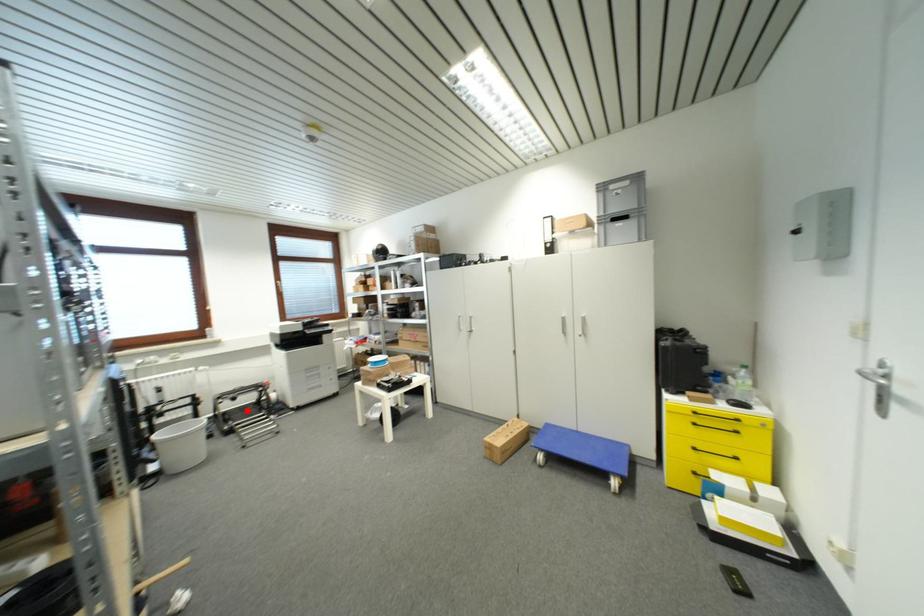
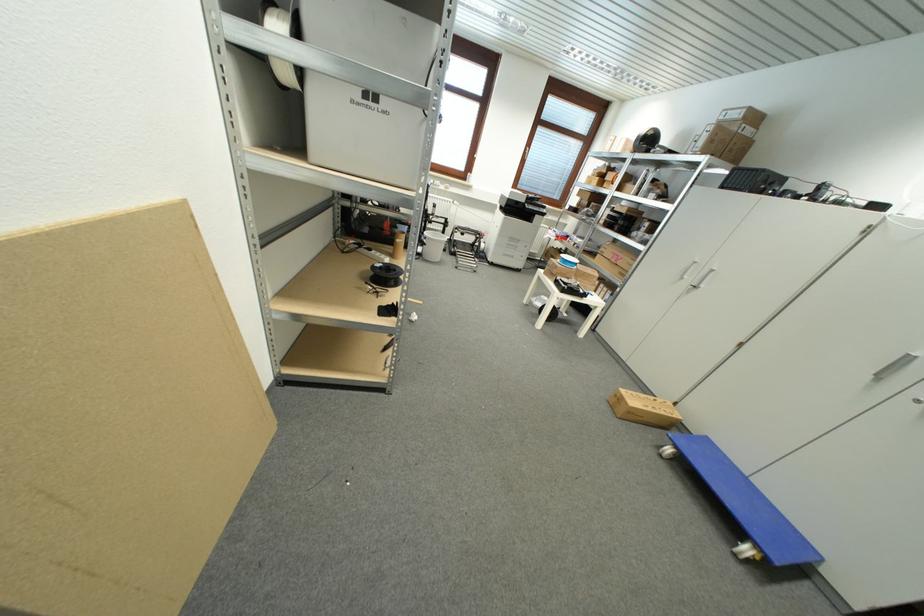
Locate, in the second image, the point that corresponds to the highlighted location in the first image.

(468, 246)